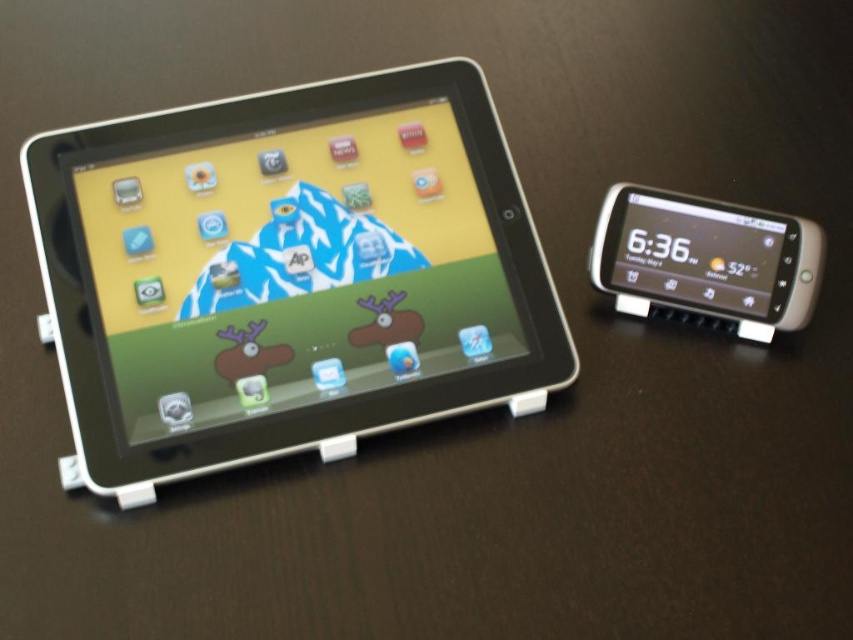
Question: Does black plastic tablet at left appear on the left side of white glossy phone at right?

Choices:
 (A) yes
 (B) no

Answer: (A)

Question: Which point is closer to the camera?

Choices:
 (A) black plastic tablet at left
 (B) white glossy phone at right

Answer: (A)

Question: Is black plastic tablet at left further to the viewer compared to white glossy phone at right?

Choices:
 (A) no
 (B) yes

Answer: (A)

Question: Which point is farther to the camera?

Choices:
 (A) black plastic tablet at left
 (B) white glossy phone at right

Answer: (B)

Question: Is black plastic tablet at left thinner than white glossy phone at right?

Choices:
 (A) yes
 (B) no

Answer: (B)